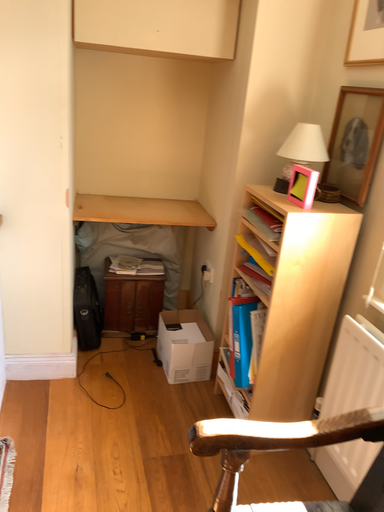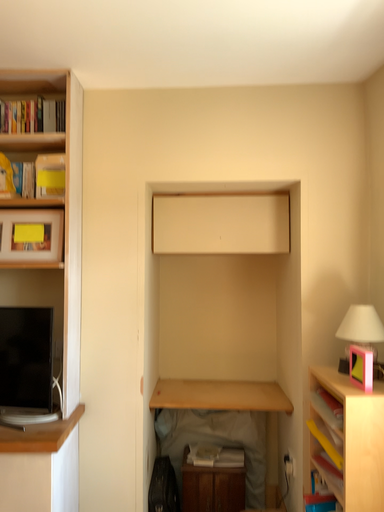
Question: Which way did the camera rotate in the video?

Choices:
 (A) rotated right
 (B) rotated left

Answer: (B)